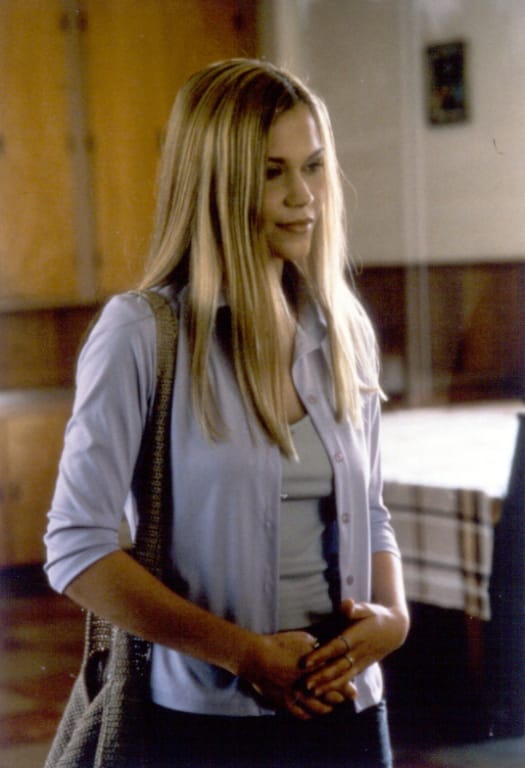
Locate an element on the screen. Image resolution: width=525 pixels, height=768 pixels. wood cabinet is located at coordinates (26, 41), (35, 504), (120, 177).